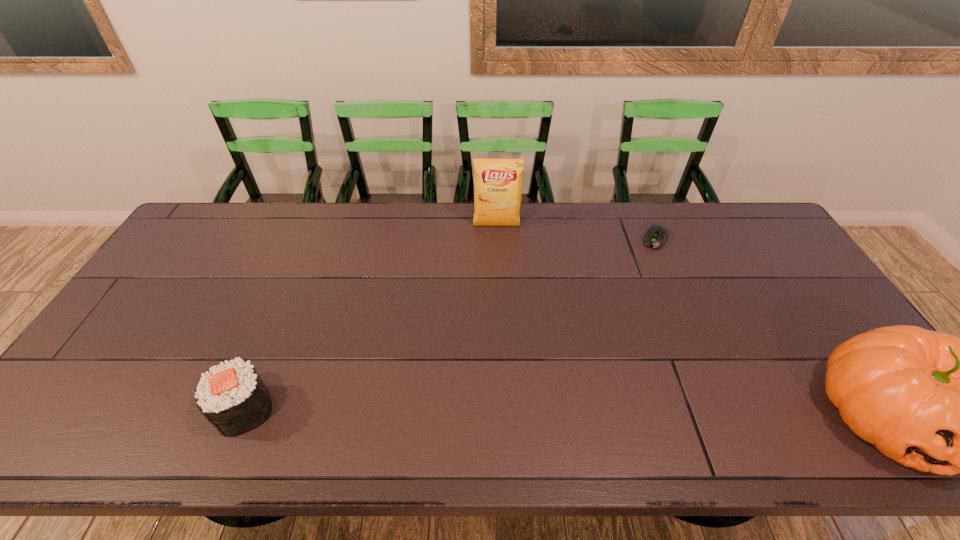
Find the location of `vacant space that satisfies the following two spatial constraints: 1. on the back side of the third object from right to left; 2. on the right side of the leftmost object`. vacant space that satisfies the following two spatial constraints: 1. on the back side of the third object from right to left; 2. on the right side of the leftmost object is located at coordinates (321, 226).

The height and width of the screenshot is (540, 960). Find the location of `free location that satisfies the following two spatial constraints: 1. on the front side of the second object from right to left; 2. on the left side of the second object from left to right`. free location that satisfies the following two spatial constraints: 1. on the front side of the second object from right to left; 2. on the left side of the second object from left to right is located at coordinates (497, 238).